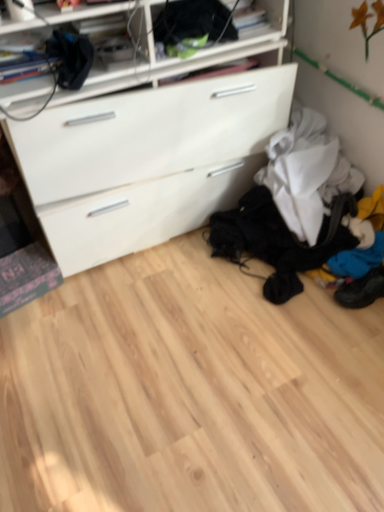
Where is `free space on the front side of blue fabric shoe at lower right`? Image resolution: width=384 pixels, height=512 pixels. free space on the front side of blue fabric shoe at lower right is located at coordinates (364, 332).